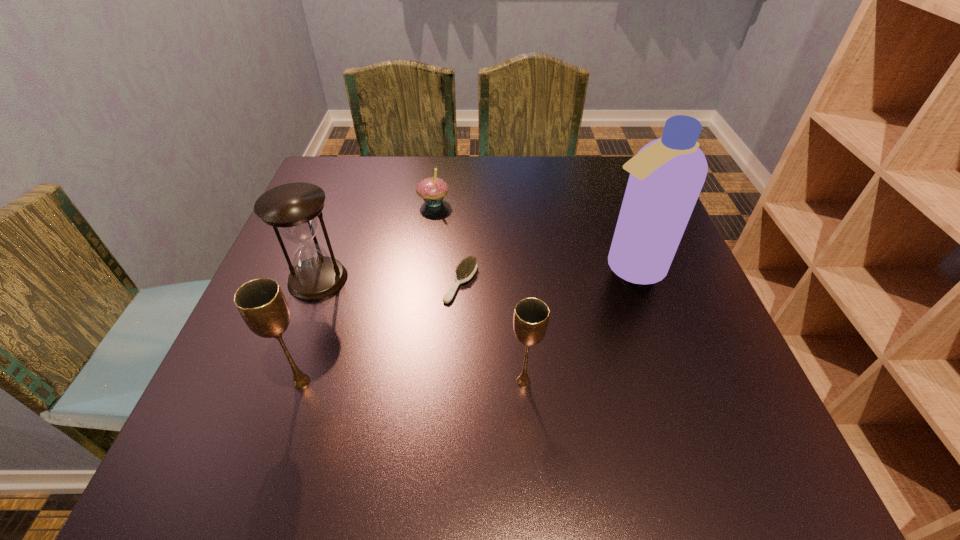
Identify the location of object that is at the near left corner. (261, 303).

The height and width of the screenshot is (540, 960). I want to click on free space at the far edge of the desktop, so tap(574, 191).

Image resolution: width=960 pixels, height=540 pixels. What are the coordinates of `free region at the near edge of the desktop` in the screenshot? It's located at (355, 414).

Where is `vacant space at the left edge of the desktop`? Image resolution: width=960 pixels, height=540 pixels. vacant space at the left edge of the desktop is located at coordinates (290, 325).

Identify the location of vacant position at the right edge of the desktop. (675, 327).

Locate an element on the screen. Image resolution: width=960 pixels, height=540 pixels. free location at the far left corner is located at coordinates coord(328,166).

This screenshot has width=960, height=540. I want to click on vacant space at the far right corner of the desktop, so click(x=594, y=159).

At what (x,y) coordinates should I click in order to perform the action: click on free space between the scrubbing brush and the taller chalice. Please return your answer as a coordinate pair (x, y). Image resolution: width=960 pixels, height=540 pixels. Looking at the image, I should click on (381, 332).

At what (x,y) coordinates should I click in order to perform the action: click on vacant region between the taller chalice and the rightmost object. Please return your answer as a coordinate pair (x, y). Looking at the image, I should click on (466, 325).

What are the coordinates of `free space between the rightmost object and the taller chalice` in the screenshot? It's located at (466, 325).